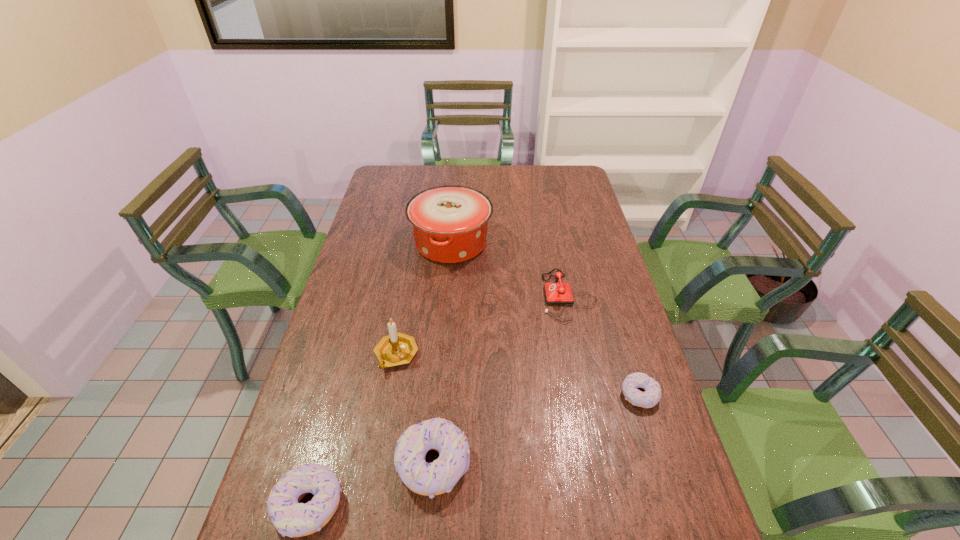
Identify the location of vacant region at the left edge. (367, 332).

Identify the location of free region at the right edge of the desktop. (602, 246).

Image resolution: width=960 pixels, height=540 pixels. Find the location of `vacant space in between the tallest object and the farthest doughnut`. vacant space in between the tallest object and the farthest doughnut is located at coordinates (545, 319).

Identify the location of empty space that is in between the rightmost doughnut and the telephone. This screenshot has height=540, width=960. (604, 346).

Locate an element on the screen. The image size is (960, 540). free spot between the fourth nearest object and the tallest object is located at coordinates (423, 299).

The width and height of the screenshot is (960, 540). Identify the location of vacant space that's between the second doughnut from right to left and the casserole. (443, 353).

Locate an element on the screen. Image resolution: width=960 pixels, height=540 pixels. blank region between the tallest object and the telephone is located at coordinates (510, 269).

I want to click on free space between the second doughnut from left to right and the third farthest object, so click(415, 409).

At what (x,y) coordinates should I click in order to perform the action: click on free point between the third nearest object and the telephone. Please return your answer as a coordinate pair (x, y). The image size is (960, 540). Looking at the image, I should click on (604, 346).

This screenshot has width=960, height=540. What are the coordinates of `empty space that is in between the rightmost doughnut and the second doughnut from left to right` in the screenshot? It's located at (537, 429).